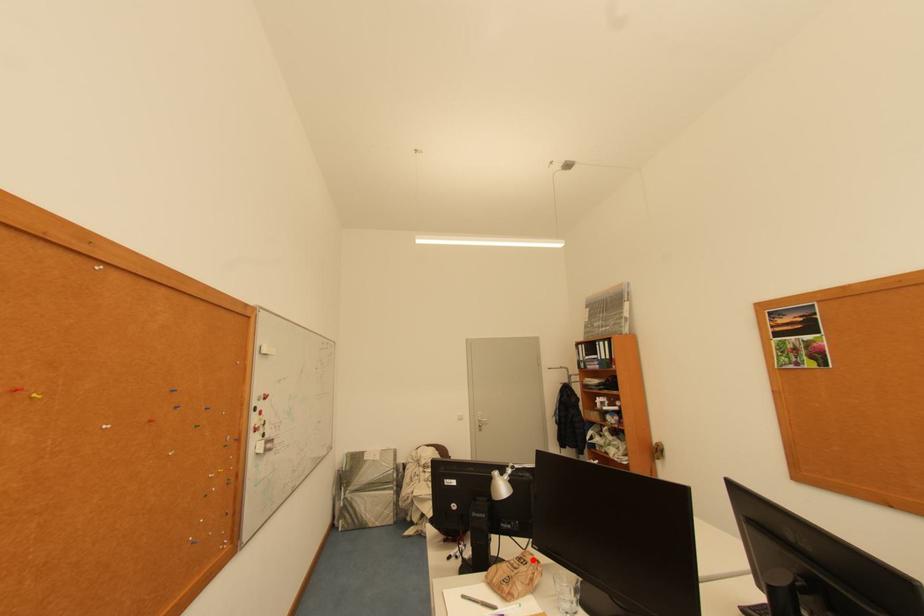
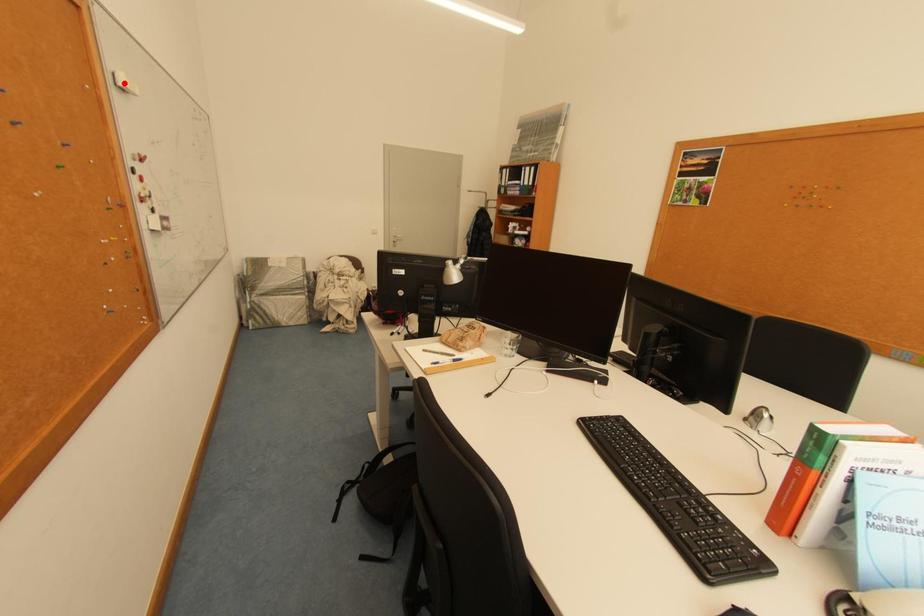
I am providing you with two images of the same scene from different viewpoints. A red point is marked on the first image and another point is marked on the second image. Do the highlighted points in image1 and image2 indicate the same real-world spot?

No